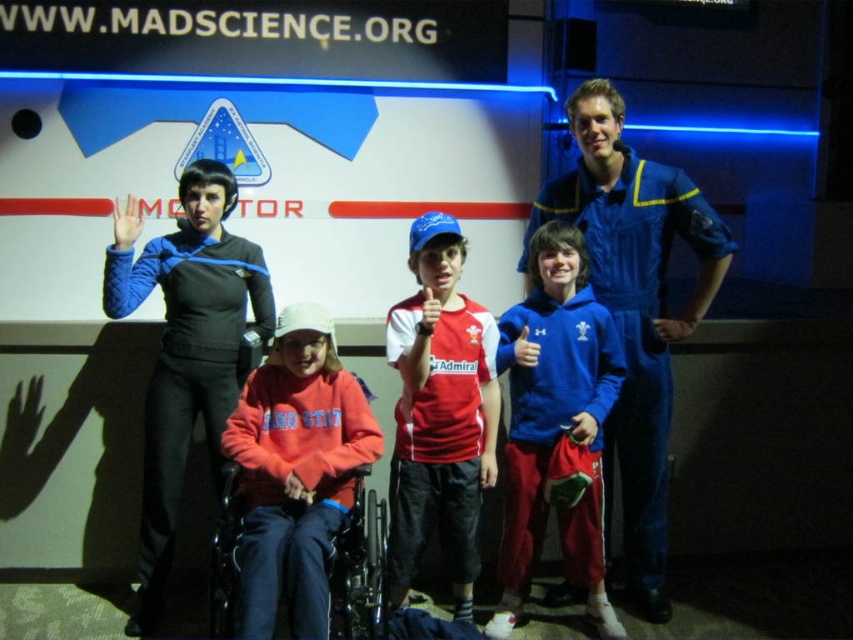
You are a photographer setting up for a group photo. The scene has a red cotton shirt at center and a blue fabric wheelchair at center. You need to ensure that both are fully visible in the frame. Given their sizes, which object might require more space in the photo to be fully captured?

The blue fabric wheelchair at center requires more space in the photo because it has a greater width than the red cotton shirt at center.

You are a photographer setting up for a group photo. You have a blue jumpsuit at right and a blue fabric wheelchair at center in your frame. Which object takes up more space in the photo?

The blue jumpsuit at right takes up more space in the photo because it has a larger size compared to the blue fabric wheelchair at center.